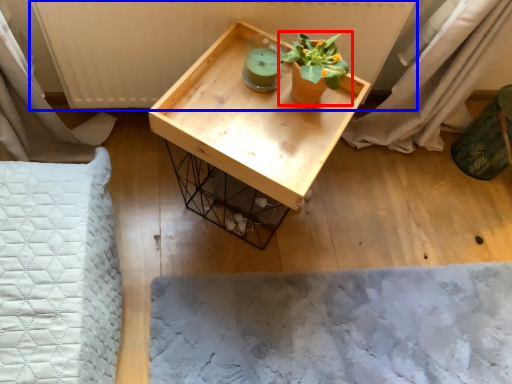
Question: Which of the following is the farthest to the observer, houseplant (highlighted by a red box) or radiator (highlighted by a blue box)?

Choices:
 (A) houseplant
 (B) radiator

Answer: (B)